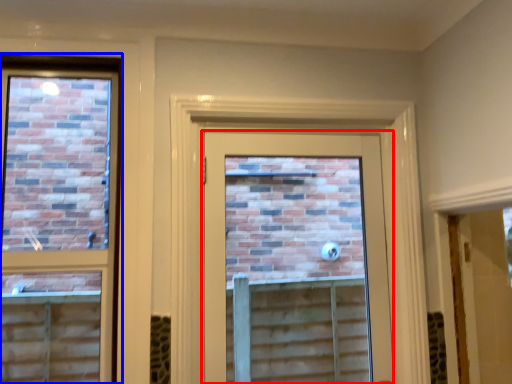
Question: Among these objects, which one is nearest to the camera, door (highlighted by a red box) or window (highlighted by a blue box)?

Choices:
 (A) door
 (B) window

Answer: (B)